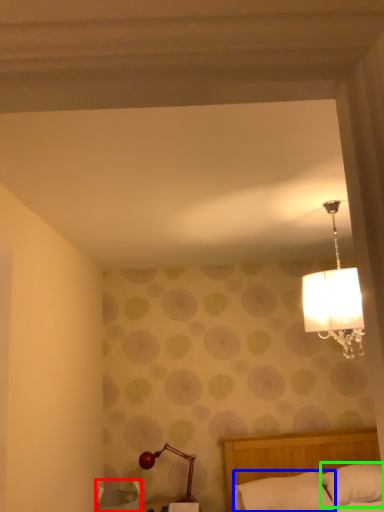
Question: Based on their relative distances, which object is nearer to furniture (highlighted by a red box)? Choose from pillow (highlighted by a blue box) and pillow (highlighted by a green box).

Choices:
 (A) pillow
 (B) pillow

Answer: (A)